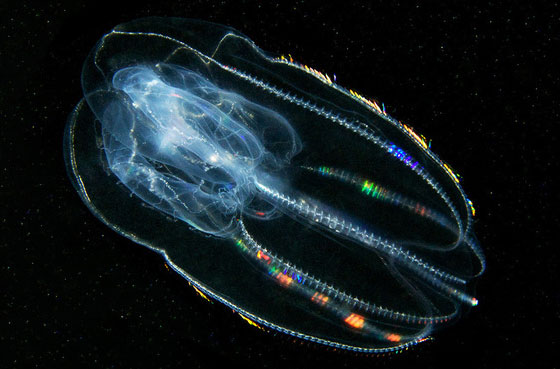
You are a GUI agent. You are given a task and a screenshot of the screen. Output one action in this format:
    pyautogui.click(x=<x>, y=<y>)
    Task: Click on the orange light
    
    Given the screenshot: What is the action you would take?
    pyautogui.click(x=385, y=339), pyautogui.click(x=347, y=336), pyautogui.click(x=326, y=305), pyautogui.click(x=288, y=296)